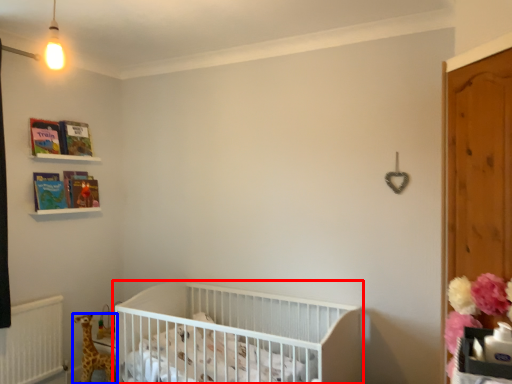
Question: Which object appears farthest to the camera in this image, infant bed (highlighted by a red box) or giraffe (highlighted by a blue box)?

Choices:
 (A) infant bed
 (B) giraffe

Answer: (B)